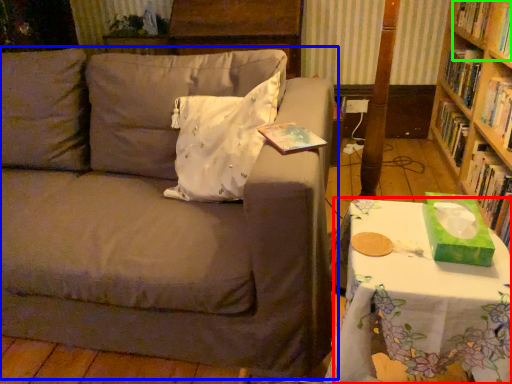
Question: Which is nearer to the table (highlighted by a red box)? studio couch (highlighted by a blue box) or book (highlighted by a green box).

Choices:
 (A) studio couch
 (B) book

Answer: (A)